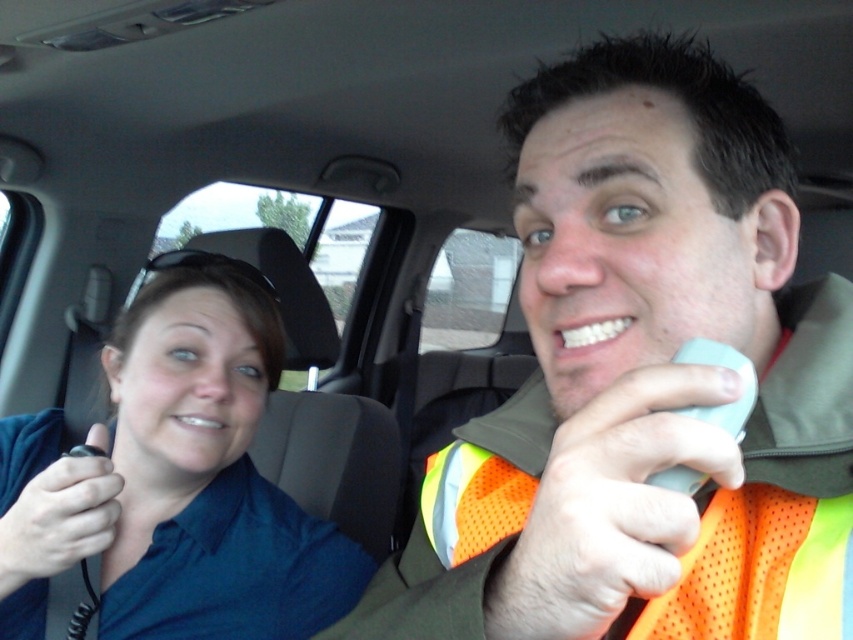
You are a passenger in the vehicle and need to hand a document to the person wearing the orange mesh safety vest at center. Which direction should you turn to reach them from the blue fabric shirt at left?

The orange mesh safety vest at center is behind the blue fabric shirt at left, so you should turn to your right to reach the person wearing the orange mesh safety vest at center.

You are a passenger in the vehicle and want to know which clothing item takes up more space between the blue fabric shirt at left and the orange mesh safety vest at center. Which one is larger?

The blue fabric shirt at left is bigger than the orange mesh safety vest at center, so the blue fabric shirt at left takes up more space.

You are a passenger in the vehicle and need to reach the blue fabric shirt at left and the orange mesh safety vest at center. Which item is closer to the ceiling?

The blue fabric shirt at left is much taller than the orange mesh safety vest at center, so it is closer to the ceiling.